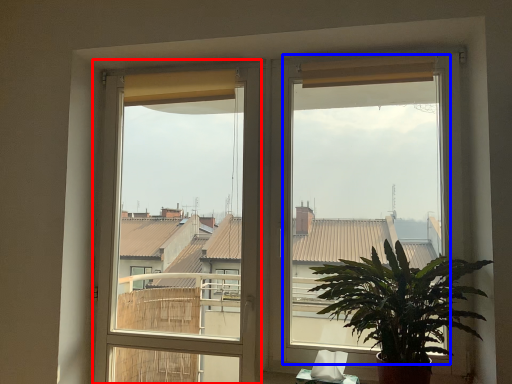
Question: Which object appears farthest to the camera in this image, window frame (highlighted by a red box) or window screen (highlighted by a blue box)?

Choices:
 (A) window frame
 (B) window screen

Answer: (A)